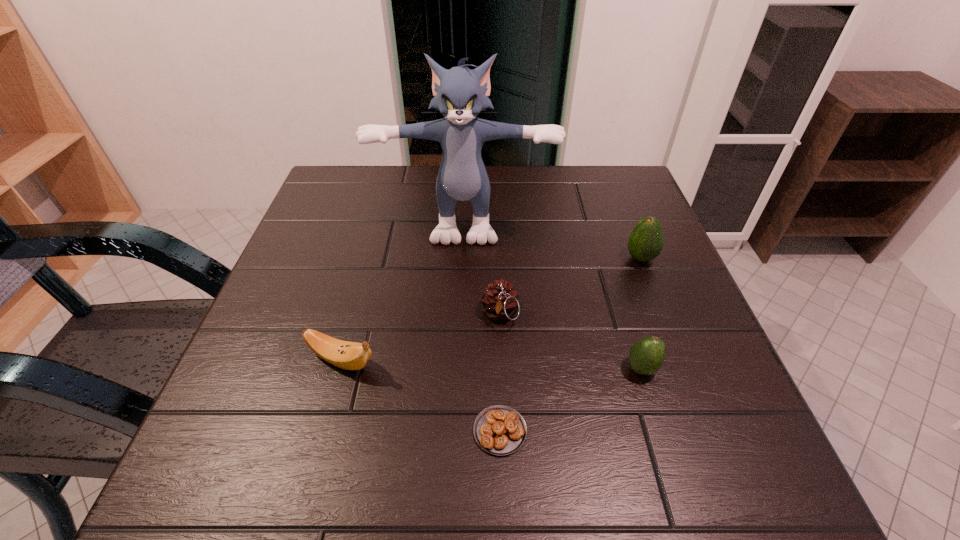
Identify the location of the farthest object. (460, 94).

Find the location of a particular element. The height and width of the screenshot is (540, 960). the tallest object is located at coordinates (460, 94).

Identify the location of the rightmost object. The image size is (960, 540). (646, 241).

The image size is (960, 540). In order to click on the taller avocado in this screenshot , I will do `click(646, 241)`.

Locate an element on the screen. The image size is (960, 540). banana is located at coordinates (347, 355).

This screenshot has width=960, height=540. Find the location of `pinecone`. pinecone is located at coordinates (x=500, y=301).

Where is `the second object from right to left`? This screenshot has width=960, height=540. the second object from right to left is located at coordinates (646, 356).

Find the location of `the shorter avocado`. the shorter avocado is located at coordinates (646, 356).

I want to click on the nearest object, so click(x=500, y=430).

The width and height of the screenshot is (960, 540). I want to click on the shortest object, so click(500, 430).